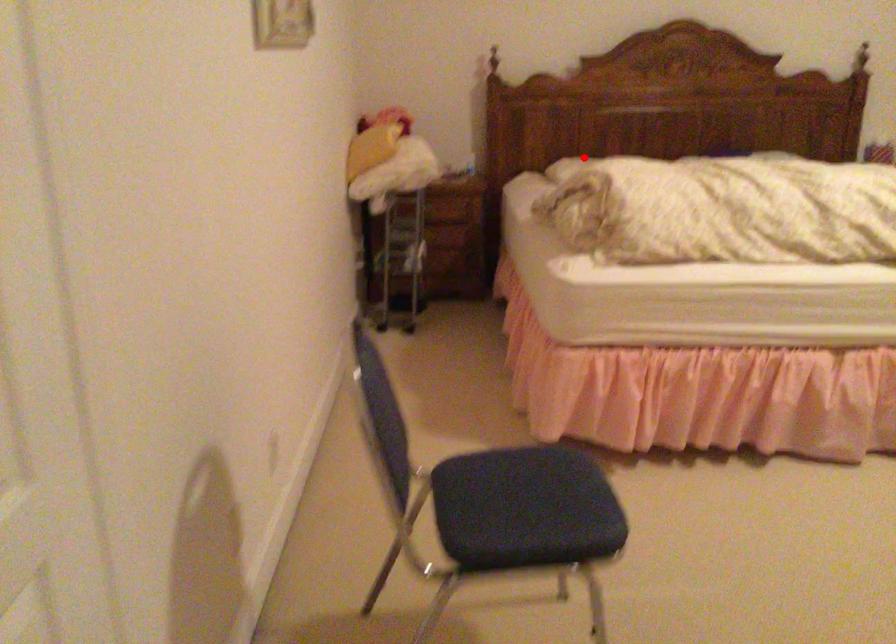
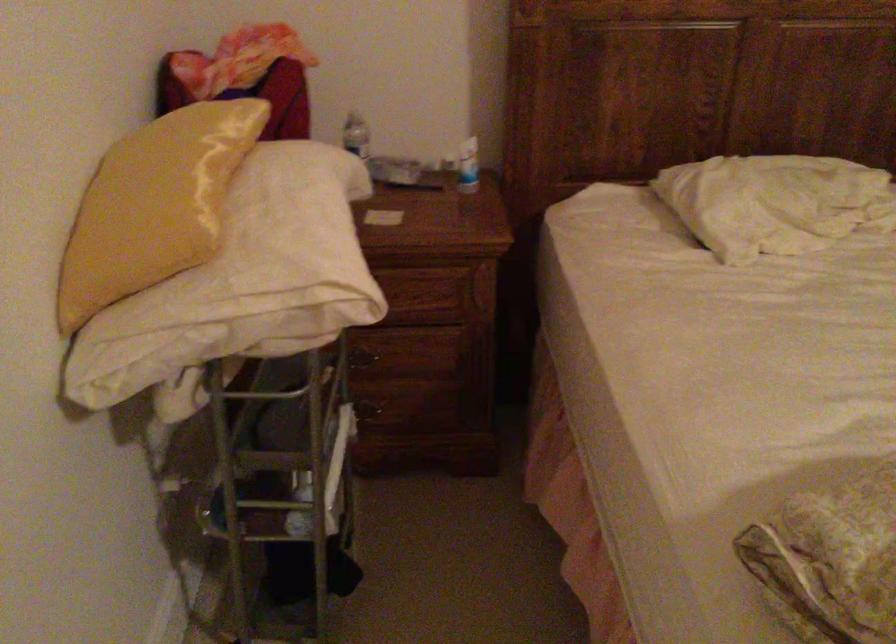
Question: I am providing you with two images of the same scene from different viewpoints. Image1 has a red point marked. In image2, the corresponding 3D location appears at what relative position? Reply with the corresponding letter.

Choices:
 (A) Closer
 (B) Farther

Answer: (A)